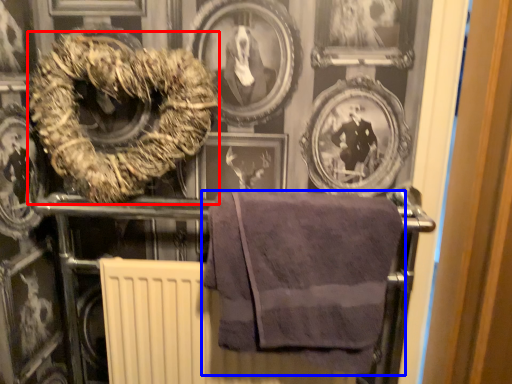
Question: Which point is closer to the camera, towel (highlighted by a red box) or towel (highlighted by a blue box)?

Choices:
 (A) towel
 (B) towel

Answer: (B)